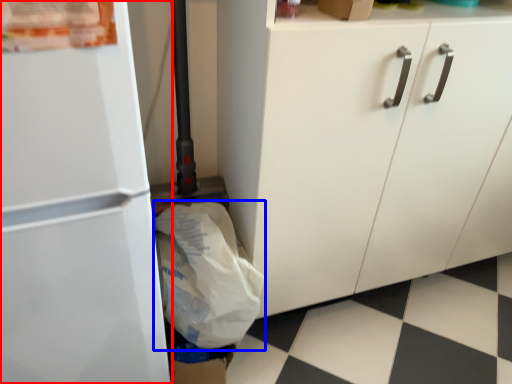
Question: Which object is closer to the camera taking this photo, refrigerator (highlighted by a red box) or grocery bag (highlighted by a blue box)?

Choices:
 (A) refrigerator
 (B) grocery bag

Answer: (A)